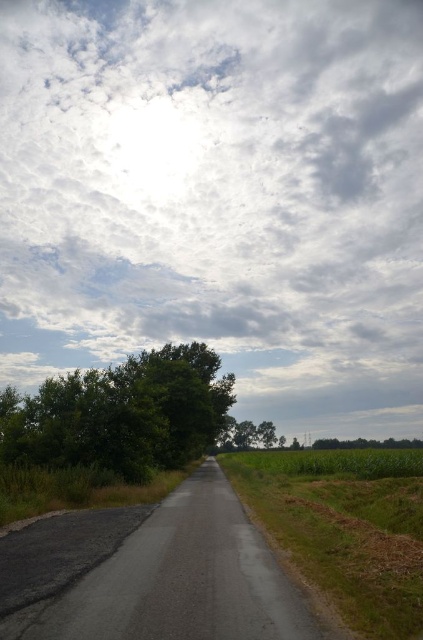
Question: Which is farther from the cloudy sky at upper center?

Choices:
 (A) green grassy field at center
 (B) green leafy tree at center

Answer: (A)

Question: Can you confirm if green leafy tree at left is positioned above green leafy tree at lower right?

Choices:
 (A) no
 (B) yes

Answer: (B)

Question: Is green grassy field at center below green leafy tree at center?

Choices:
 (A) no
 (B) yes

Answer: (A)

Question: Which of the following is the farthest from the observer?

Choices:
 (A) (69, 138)
 (B) (118, 404)
 (C) (343, 442)

Answer: (C)

Question: Which point is closer to the camera?

Choices:
 (A) (334, 440)
 (B) (266, 420)

Answer: (A)

Question: Does cloudy sky at upper center have a smaller size compared to green leafy tree at lower right?

Choices:
 (A) no
 (B) yes

Answer: (A)